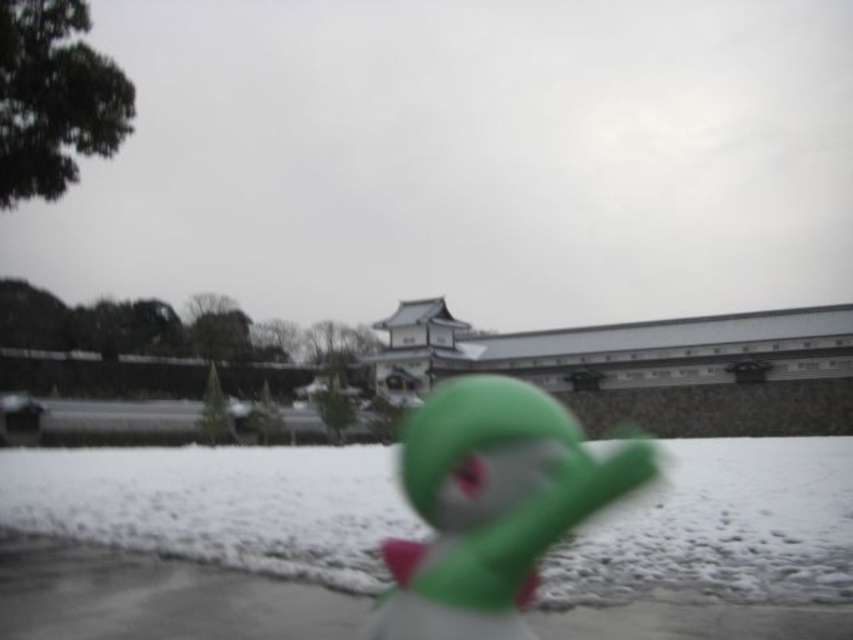
You are a photographer trying to capture the green rubber duck at center and the white fluffy snow at center in a single shot. Based on their sizes, which object should you focus on to ensure both are in focus?

The white fluffy snow at center is not as tall as green rubber duck at center, so you should focus on the green rubber duck at center to ensure both are in focus.

You are taking a photo of the snowy scene with a camera that has a shallow depth of field. You want to focus on the point that is closer to the camera. Which point should you focus on between point (x=132, y=532) and point (x=445, y=436)?

Point (x=445, y=436) is closer to the camera than point (x=132, y=532), so you should focus on point (x=445, y=436) to ensure it is in sharp focus.